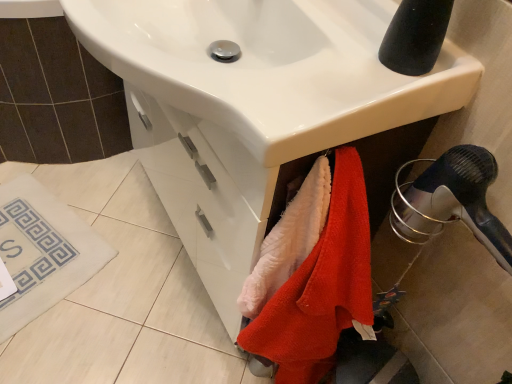
At what (x,y) coordinates should I click in order to perform the action: click on vacant space to the left of black rubber tap at upper right. Please return your answer as a coordinate pair (x, y). This screenshot has height=384, width=512. Looking at the image, I should click on (324, 56).